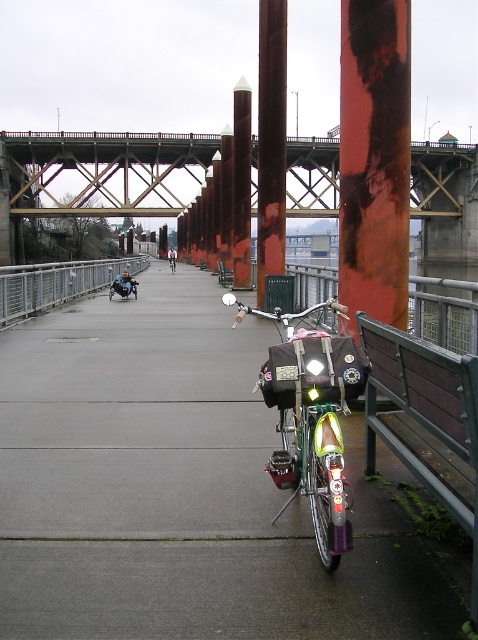
Is point (1, 525) more distant than point (310, 140)?

No, (1, 525) is closer to viewer.

Can you confirm if concrete at center is wider than rusty metal bridge at upper center?

Incorrect, concrete at center's width does not surpass rusty metal bridge at upper center's.

Between point (294, 620) and point (451, 166), which one is positioned behind?

Positioned behind is point (451, 166).

This screenshot has width=478, height=640. In order to click on concrete at center in this screenshot , I will do pos(180,488).

Looking at this image, is rusty metal pole at center in front of metallic gray rail at left?

That is False.

I want to click on rusty metal pole at center, so click(271, 141).

Who is more forward, (273,76) or (101,276)?

Positioned in front is point (273,76).

This screenshot has width=478, height=640. I want to click on rusty metal pole at center, so click(271, 141).

Who is more forward, (x=235, y=605) or (x=260, y=291)?

Positioned in front is point (x=235, y=605).

Locate an element on the screen. The width and height of the screenshot is (478, 640). concrete at center is located at coordinates (180, 488).

I want to click on concrete at center, so click(180, 488).